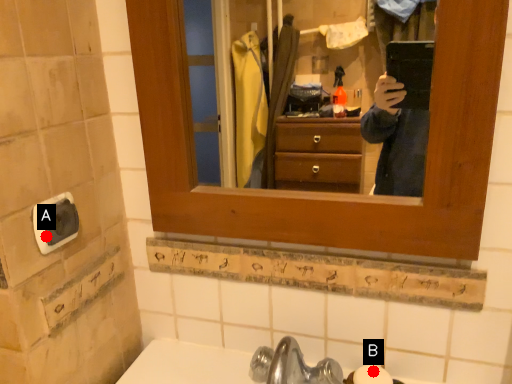
Question: Two points are circled on the image, labeled by A and B beside each circle. Among these points, which one is farthest from the camera?

Choices:
 (A) A is further
 (B) B is further

Answer: (B)